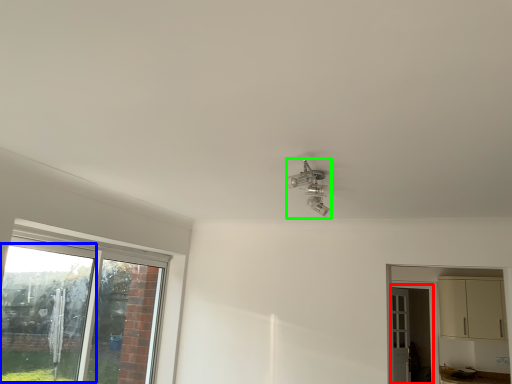
Question: Estimate the real-world distances between objects in this image. Which object is closer to screen door (highlighted by a red box), window screen (highlighted by a blue box) or light fixture (highlighted by a green box)?

Choices:
 (A) window screen
 (B) light fixture

Answer: (B)